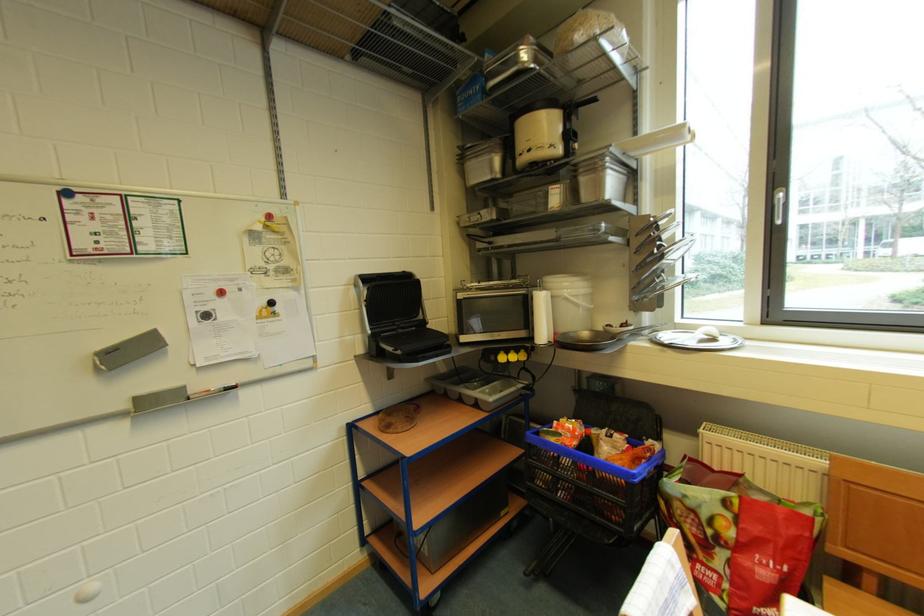
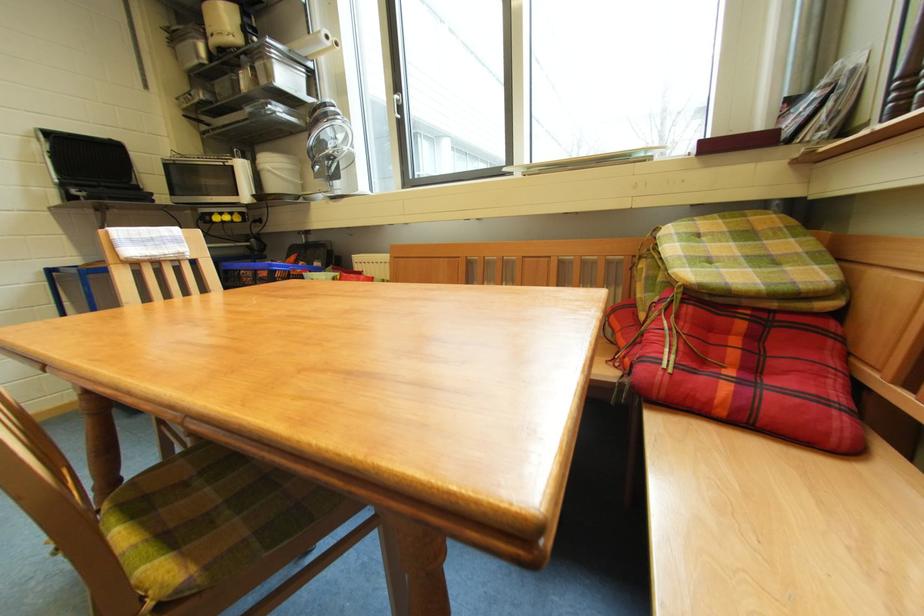
Locate, in the second image, the point that corresponds to pixel 578 299 in the first image.

(281, 171)